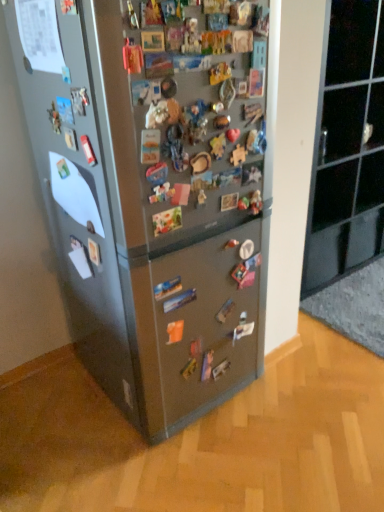
This screenshot has width=384, height=512. Find the location of `free spot in front of satin silver fridge at center`. free spot in front of satin silver fridge at center is located at coordinates (173, 462).